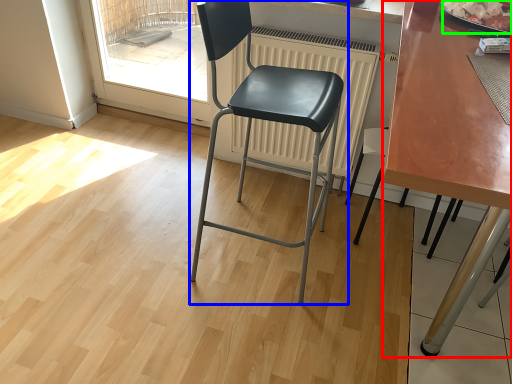
Question: Based on their relative distances, which object is nearer to table (highlighted by a red box)? Choose from chair (highlighted by a blue box) and food (highlighted by a green box).

Choices:
 (A) chair
 (B) food

Answer: (B)